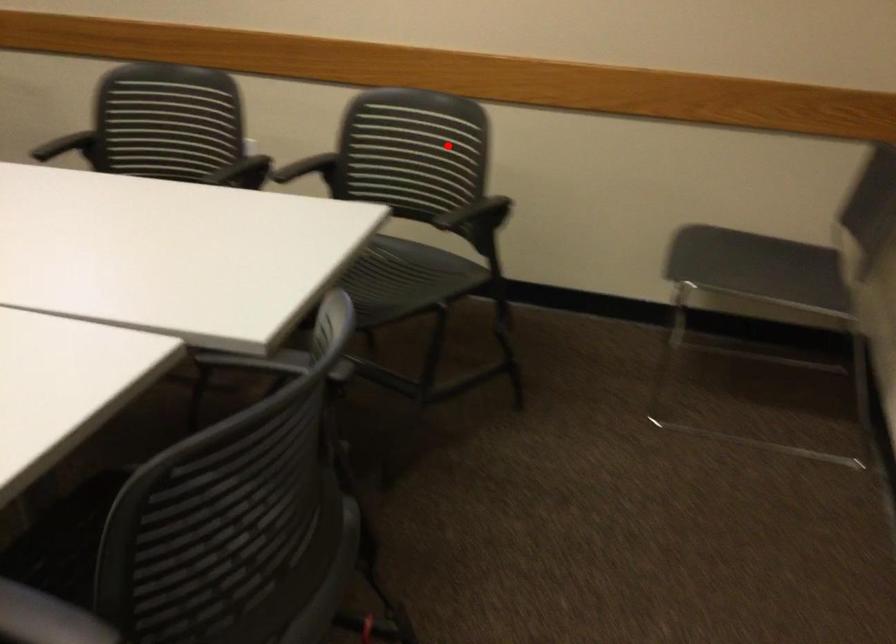
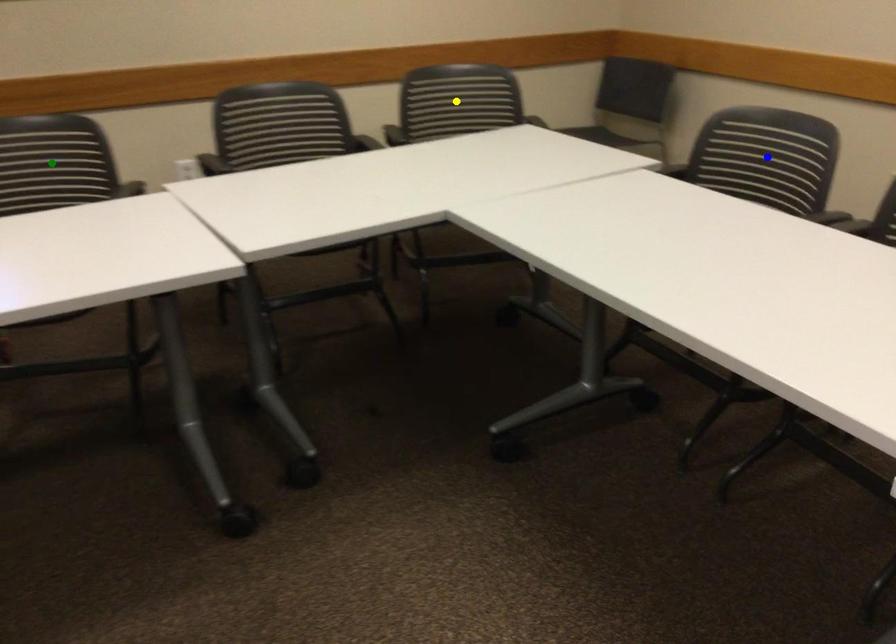
Question: I am providing you with two images of the same scene from different viewpoints. A red point is marked on the first image. You are given multiple points on the second image. Which point in image 2 represents the same 3d spot as the red point in image 1?

Choices:
 (A) green point
 (B) yellow point
 (C) blue point

Answer: (B)